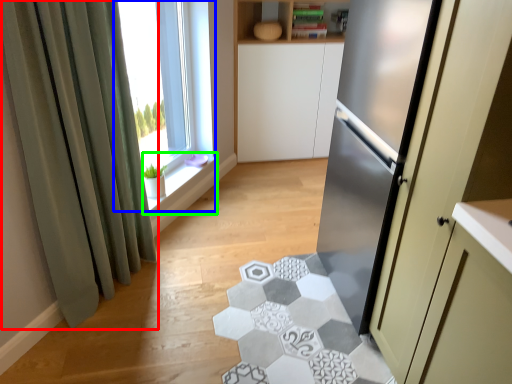
Question: Considering the real-world distances, which object is closest to curtain (highlighted by a red box)? window (highlighted by a blue box) or window sill (highlighted by a green box).

Choices:
 (A) window
 (B) window sill

Answer: (B)